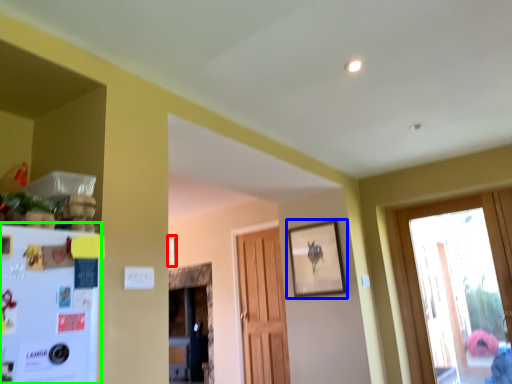
Question: Which object is the farthest from picture frame (highlighted by a red box)? Choose among these: picture frame (highlighted by a blue box) or fridge (highlighted by a green box).

Choices:
 (A) picture frame
 (B) fridge

Answer: (B)